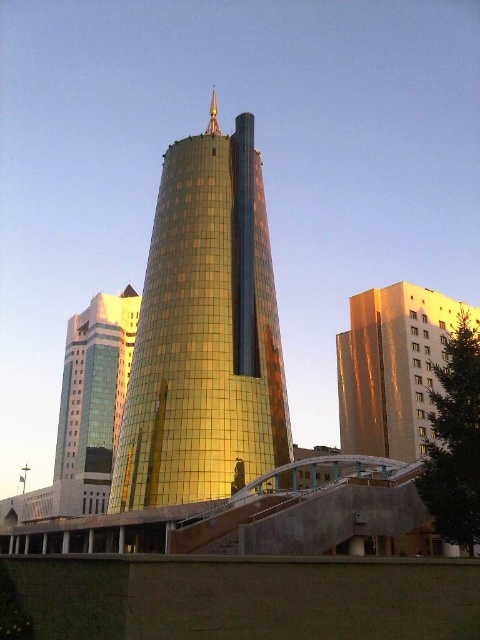
Between gold reflective tower at center and gold reflective building at center, which one has more height?

Standing taller between the two is gold reflective tower at center.

Where is `gold reflective tower at center`? The image size is (480, 640). gold reflective tower at center is located at coordinates pyautogui.click(x=204, y=332).

From the picture: Is the position of gold reflective tower at center less distant than that of matte glass skyscraper at left?

That is True.

What do you see at coordinates (204, 332) in the screenshot? I see `gold reflective tower at center` at bounding box center [204, 332].

The height and width of the screenshot is (640, 480). What do you see at coordinates (204, 332) in the screenshot?
I see `gold reflective tower at center` at bounding box center [204, 332].

Identify the location of gold reflective tower at center. (204, 332).

Between point (411, 401) and point (84, 417), which one is positioned behind?

The point (84, 417) is more distant.

Who is more forward, (369, 394) or (88, 336)?

Positioned in front is point (369, 394).

Find the location of `gold reflective building at center`. gold reflective building at center is located at coordinates (392, 368).

In order to click on gold reflective building at center in this screenshot , I will do `click(392, 368)`.